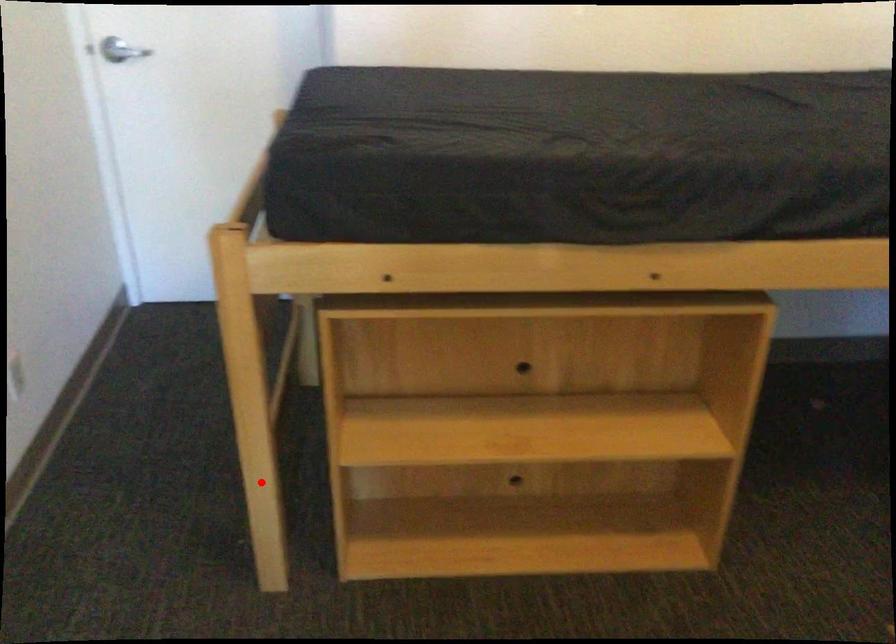
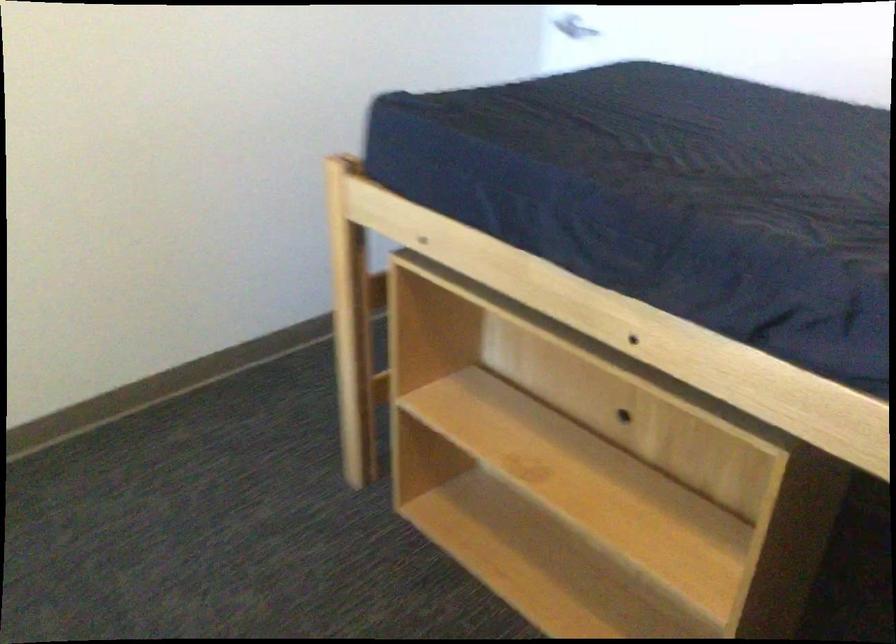
Question: I am providing you with two images of the same scene from different viewpoints. In image1, a red point is highlighted. Considering the same 3D point in image2, which of the following is correct?

Choices:
 (A) It is closer
 (B) It is farther

Answer: (B)